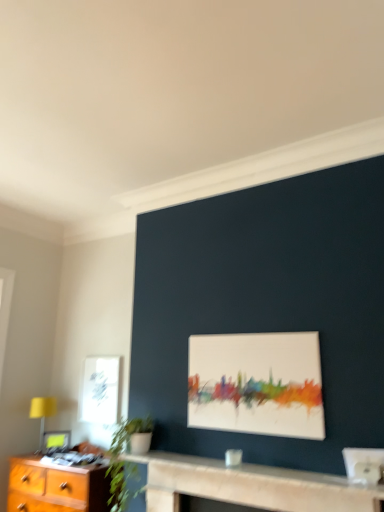
The width and height of the screenshot is (384, 512). What do you see at coordinates (56, 441) in the screenshot? I see `matte black picture frame at lower left, arranged as the first picture frame when ordered from the bottom` at bounding box center [56, 441].

Measure the distance between point [136,443] and camera.

The distance of point [136,443] from camera is 8.80 feet.

Image resolution: width=384 pixels, height=512 pixels. Describe the element at coordinates (126, 461) in the screenshot. I see `green leafy plant at lower left` at that location.

From the picture: What is the approximate height of smooth stone fireplace at center?

The height of smooth stone fireplace at center is 1.12 inches.

Where is `white matte painting at center, marked as the 1th picture frame in a right-to-left arrangement`? This screenshot has height=512, width=384. white matte painting at center, marked as the 1th picture frame in a right-to-left arrangement is located at coordinates (257, 384).

From the image's perspective, is green leafy plant at lower left located above or below white matte painting at center, arranged as the first picture frame when viewed from the top?

Clearly, from the image's perspective, green leafy plant at lower left is below white matte painting at center, arranged as the first picture frame when viewed from the top.

Considering the positions of objects green leafy plant at lower left and white matte painting at center, marked as the 1th picture frame in a right-to-left arrangement, in the image provided, who is in front, green leafy plant at lower left or white matte painting at center, marked as the 1th picture frame in a right-to-left arrangement,?

Positioned in front is white matte painting at center, marked as the 1th picture frame in a right-to-left arrangement.

From a real-world perspective, which object stands above the other?

From a 3D spatial view, white matte painting at center, marked as the 1th picture frame in a right-to-left arrangement, is above.

Is point (110, 485) closer to viewer compared to point (301, 398)?

That is False.

Considering the relative positions of white matte painting at center, arranged as the 2th picture frame when ordered from the bottom, and white paper at upper left in the image provided, is white matte painting at center, arranged as the 2th picture frame when ordered from the bottom, to the left or to the right of white paper at upper left?

Clearly, white matte painting at center, arranged as the 2th picture frame when ordered from the bottom, is on the right of white paper at upper left in the image.

From a real-world perspective, is white matte painting at center, arranged as the first picture frame when viewed from the top, below white paper at upper left?

Actually, white matte painting at center, arranged as the first picture frame when viewed from the top, is physically above white paper at upper left in the real world.

Is white matte painting at center, marked as the 1th picture frame in a right-to-left arrangement, oriented towards white paper at upper left?

No, white matte painting at center, marked as the 1th picture frame in a right-to-left arrangement, is not aimed at white paper at upper left.

Considering their positions, is white matte painting at center, positioned as the 1th picture frame in front-to-back order, located in front of or behind white paper at upper left?

white matte painting at center, positioned as the 1th picture frame in front-to-back order, is positioned closer to the viewer than white paper at upper left.

Is smooth stone fireplace at center not near yellow fabric lampshade at left?

Yes, smooth stone fireplace at center and yellow fabric lampshade at left are quite far apart.

Considering the sizes of objects smooth stone fireplace at center and yellow fabric lampshade at left in the image provided, who is taller, smooth stone fireplace at center or yellow fabric lampshade at left?

Standing taller between the two is yellow fabric lampshade at left.

From a real-world perspective, is smooth stone fireplace at center physically located above or below yellow fabric lampshade at left?

From a real-world perspective, smooth stone fireplace at center is physically below yellow fabric lampshade at left.

Where is `table lamp above the smooth stone fireplace at center (from a real-world perspective)`? The image size is (384, 512). table lamp above the smooth stone fireplace at center (from a real-world perspective) is located at coordinates (42, 412).

Locate an element on the screen. window above the yellow fabric lampshade at left (from a real-world perspective) is located at coordinates (100, 390).

Who is taller, white paper at upper left or yellow fabric lampshade at left?

With more height is white paper at upper left.

Does white paper at upper left lie in front of yellow fabric lampshade at left?

No, the depth of white paper at upper left is greater than that of yellow fabric lampshade at left.

From the image's perspective, which is below, smooth stone fireplace at center or white paper at upper left?

From the image's view, smooth stone fireplace at center is below.

Is point (340, 507) farther from viewer compared to point (91, 396)?

No, it is not.

Can you confirm if smooth stone fireplace at center is wider than white paper at upper left?

Yes.

From a real-world perspective, who is located higher, matte black picture frame at lower left, arranged as the 1th picture frame when viewed from the back, or white paper at upper left?

white paper at upper left is physically above.

Can you tell me how much matte black picture frame at lower left, which ranks as the 2th picture frame in front-to-back order, and white paper at upper left differ in facing direction?

The angle between the facing direction of matte black picture frame at lower left, which ranks as the 2th picture frame in front-to-back order, and the facing direction of white paper at upper left is 44 degrees.

Is matte black picture frame at lower left, which is counted as the second picture frame, starting from the right, oriented towards white paper at upper left?

No, matte black picture frame at lower left, which is counted as the second picture frame, starting from the right, is not turned towards white paper at upper left.

Considering the positions of points (109, 417) and (48, 447), is point (109, 417) farther from camera compared to point (48, 447)?

No, (109, 417) is in front of (48, 447).

Which object is positioned more to the left, white paper at upper left or matte black picture frame at lower left, which ranks as the 2th picture frame in front-to-back order?

matte black picture frame at lower left, which ranks as the 2th picture frame in front-to-back order, is more to the left.

Is white paper at upper left next to matte black picture frame at lower left, which ranks as the 2th picture frame in front-to-back order?

They are not placed beside each other.

I want to click on picture frame in front of the green leafy plant at lower left, so click(257, 384).

This screenshot has width=384, height=512. What are the coordinates of `window behind the white matte painting at center, positioned as the 1th picture frame in front-to-back order` in the screenshot? It's located at pyautogui.click(x=100, y=390).

In the scene shown: Considering their positions, is smooth stone fireplace at center positioned further to yellow fabric lampshade at left than matte black picture frame at lower left, arranged as the first picture frame when ordered from the bottom?

The object further to yellow fabric lampshade at left is smooth stone fireplace at center.

In the scene shown: When comparing their distances from yellow fabric lampshade at left, does white paper at upper left or white matte painting at center, marked as the 1th picture frame in a right-to-left arrangement, seem further?

white matte painting at center, marked as the 1th picture frame in a right-to-left arrangement, lies further to yellow fabric lampshade at left than the other object.

From the image, which object appears to be nearer to matte black picture frame at lower left, the first picture frame viewed from the left, green leafy plant at lower left or smooth stone fireplace at center?

Among the two, green leafy plant at lower left is located nearer to matte black picture frame at lower left, the first picture frame viewed from the left.

In the scene shown: From the image, which object appears to be nearer to green leafy plant at lower left, white paper at upper left or yellow fabric lampshade at left?

The object closer to green leafy plant at lower left is white paper at upper left.

Based on their spatial positions, is green leafy plant at lower left or yellow fabric lampshade at left closer to white matte painting at center, positioned as the 1th picture frame in front-to-back order?

green leafy plant at lower left lies closer to white matte painting at center, positioned as the 1th picture frame in front-to-back order, than the other object.

Based on their spatial positions, is yellow fabric lampshade at left or matte black picture frame at lower left, which ranks as the 2th picture frame in front-to-back order, further from white matte painting at center, which appears as the 2th picture frame when viewed from the left?

Among the two, yellow fabric lampshade at left is located further to white matte painting at center, which appears as the 2th picture frame when viewed from the left.

Which object lies nearer to the anchor point white matte painting at center, arranged as the 2th picture frame when ordered from the bottom, green leafy plant at lower left or white paper at upper left?

green leafy plant at lower left is closer to white matte painting at center, arranged as the 2th picture frame when ordered from the bottom.

Looking at the image, which one is located closer to yellow fabric lampshade at left, smooth stone fireplace at center or white paper at upper left?

Based on the image, white paper at upper left appears to be nearer to yellow fabric lampshade at left.

I want to click on table lamp between green leafy plant at lower left and white paper at upper left along the z-axis, so click(42, 412).

Identify the location of table between matte black picture frame at lower left, arranged as the 1th picture frame when viewed from the back, and white matte painting at center, arranged as the 2th picture frame when viewed from the back. (250, 486).

Image resolution: width=384 pixels, height=512 pixels. In order to click on houseplant between smooth stone fireplace at center and white paper at upper left from front to back in this screenshot , I will do `click(126, 461)`.

Find the location of a particular element. This screenshot has width=384, height=512. houseplant between smooth stone fireplace at center and yellow fabric lampshade at left along the z-axis is located at coordinates pos(126,461).